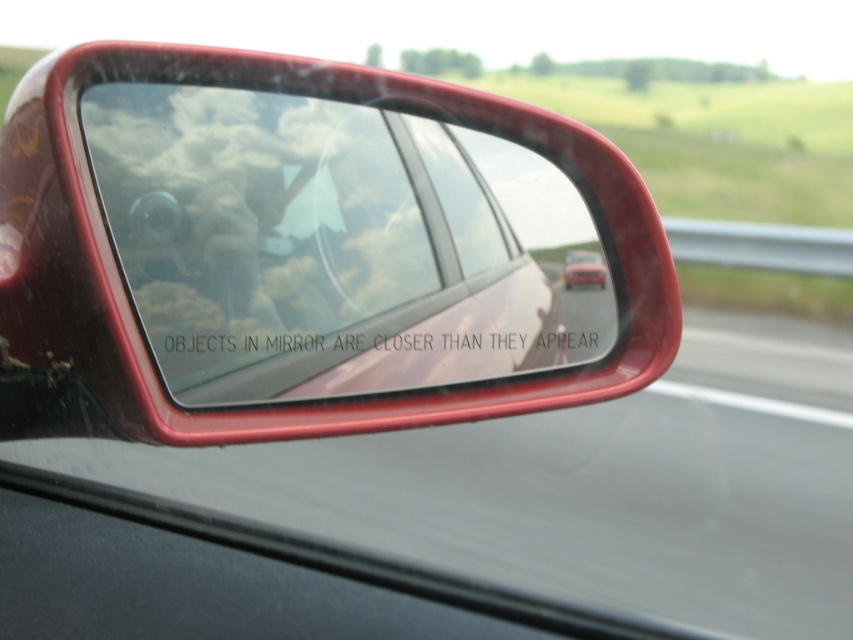
You are a passenger in the car and notice the transparent glass windshield at center and the matte red car at center in the mirror. Which object appears taller in the mirror?

The transparent glass windshield at center appears much taller than the matte red car at center in the mirror according to the mirror reflection.

You are a passenger in the car and notice the transparent glass windshield at center and the matte red car at center reflected in the side mirror. Which object appears wider in the reflection?

The transparent glass windshield at center appears wider than the matte red car at center because its width is larger.